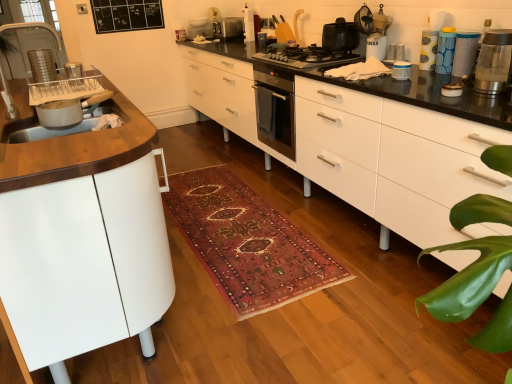
I want to click on free point behind white glossy container at upper right, the fifth appliance viewed from the back, so click(x=385, y=64).